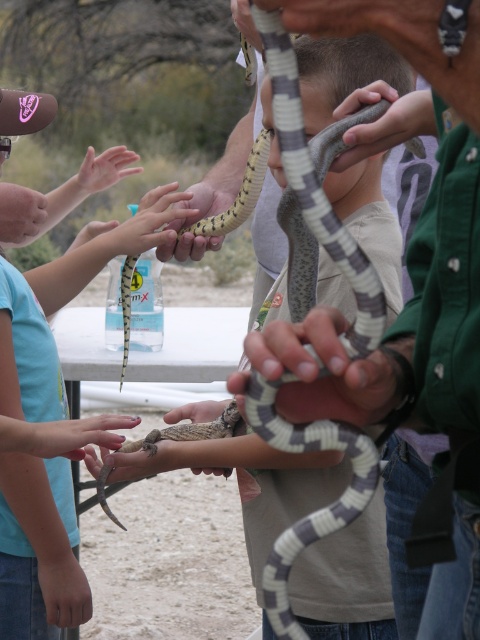
You are a photographer trying to capture a closeup of the smooth tan snake at center. You notice the smooth skin hand at center is blocking part of the snake. Can you adjust your position to the right to get a clearer shot of the snake without moving the hand?

The smooth tan snake at center is to the left of the smooth skin hand at center. Moving to the right would position you further away from the snake, so you should move to the left instead to get a clearer shot without moving the hand.

You are a photographer standing at the camera position. You want to take a closeup shot of the gray and white striped snake at center. Given that your camera has a minimum focusing distance of 5 feet, will you be able to take the photo without moving closer?

The gray and white striped snake at center is 6.03 feet away from the camera. Since the minimum focusing distance is 5 feet, you can take the closeup shot without moving closer because the snake is within the camera range.